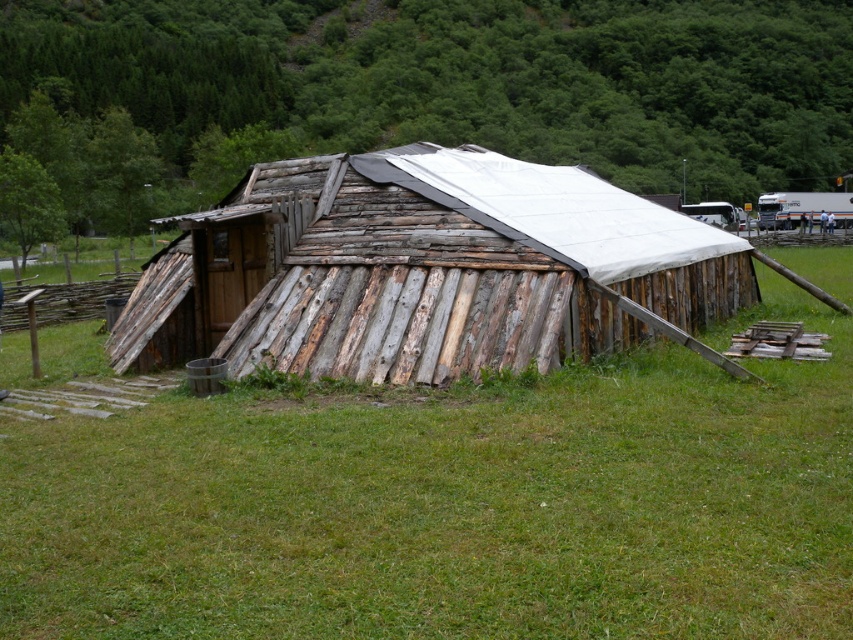
Can you confirm if green grassy at center is shorter than weathered wood barn at center?

Indeed, green grassy at center has a lesser height compared to weathered wood barn at center.

Can you confirm if green grassy at center is positioned above weathered wood barn at center?

No, green grassy at center is not above weathered wood barn at center.

The image size is (853, 640). Identify the location of green grassy at center. (451, 506).

Locate an element on the screen. The width and height of the screenshot is (853, 640). green grassy at center is located at coordinates (451, 506).

Can you confirm if green leafy hillside at upper center is positioned to the right of weathered wood barn at center?

Yes, green leafy hillside at upper center is to the right of weathered wood barn at center.

Is green leafy hillside at upper center bigger than weathered wood barn at center?

Correct, green leafy hillside at upper center is larger in size than weathered wood barn at center.

Does point (228, 32) come in front of point (738, 269)?

No.

You are a GUI agent. You are given a task and a screenshot of the screen. Output one action in this format:
    pyautogui.click(x=<x>, y=<y>)
    Task: Click on the green leafy hillside at upper center
    
    Given the screenshot: What is the action you would take?
    pyautogui.click(x=474, y=77)

In the scene shown: Who is positioned more to the left, green grassy at center or green leafy hillside at upper center?

green grassy at center

Which is above, green grassy at center or green leafy hillside at upper center?

green leafy hillside at upper center is above.

Which is in front, point (645, 429) or point (483, 144)?

Point (645, 429) is in front.

You are a GUI agent. You are given a task and a screenshot of the screen. Output one action in this format:
    pyautogui.click(x=<x>, y=<y>)
    Task: Click on the green grassy at center
    
    Given the screenshot: What is the action you would take?
    pyautogui.click(x=451, y=506)